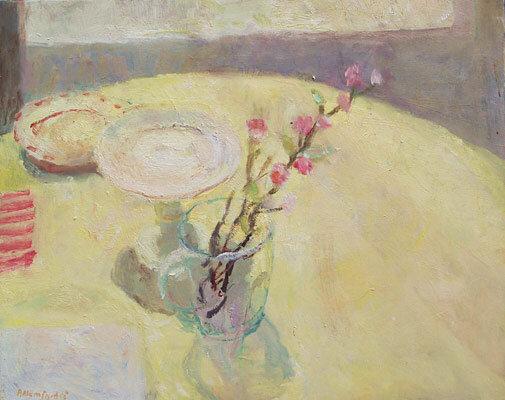
You are a GUI agent. You are given a task and a screenshot of the screen. Output one action in this format:
    pyautogui.click(x=<x>, y=<y>)
    Task: Click on the painting
    This screenshot has width=505, height=400.
    Given the screenshot: What is the action you would take?
    pyautogui.click(x=306, y=215)